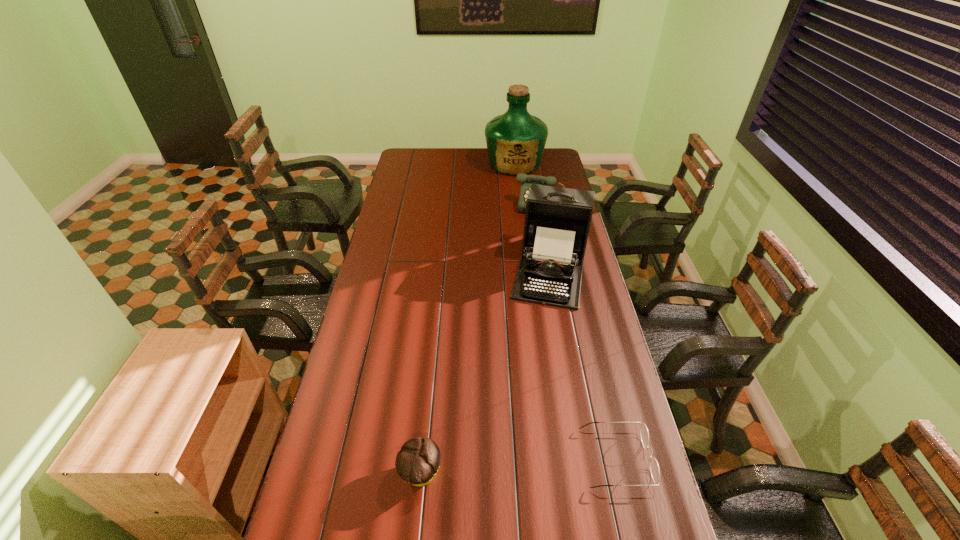
Image resolution: width=960 pixels, height=540 pixels. What are the coordinates of `free spot at the right edge of the desktop` in the screenshot? It's located at (585, 411).

Find the location of `vacant space at the far right corner of the desktop`. vacant space at the far right corner of the desktop is located at coordinates (547, 156).

Identify the location of free spot between the third shortest object and the muffin. (483, 340).

The width and height of the screenshot is (960, 540). In order to click on unoccupied position between the spectacles and the second farthest object in this screenshot , I will do `click(581, 332)`.

You are a GUI agent. You are given a task and a screenshot of the screen. Output one action in this format:
    pyautogui.click(x=<x>, y=<y>)
    Task: Click on the free space between the spectacles and the tallest object
    
    Given the screenshot: What is the action you would take?
    pyautogui.click(x=565, y=311)

The image size is (960, 540). I want to click on free space between the fourth tallest object and the liquor, so click(x=468, y=319).

Find the location of `blank region between the second tallest object and the shortest object`. blank region between the second tallest object and the shortest object is located at coordinates coord(583,364).

This screenshot has height=540, width=960. I want to click on free space between the farthest object and the second shortest object, so (x=468, y=319).

Locate which object ranks fourth in proximity to the third farthest object. Please provide its 2D coordinates. Your answer should be formatted as a tuple, i.e. [(x, y)], where the tuple contains the x and y coordinates of a point satisfying the conditions above.

[(417, 462)]

In order to click on object that is the fourth nearest to the fourth tallest object in this screenshot , I will do `click(515, 140)`.